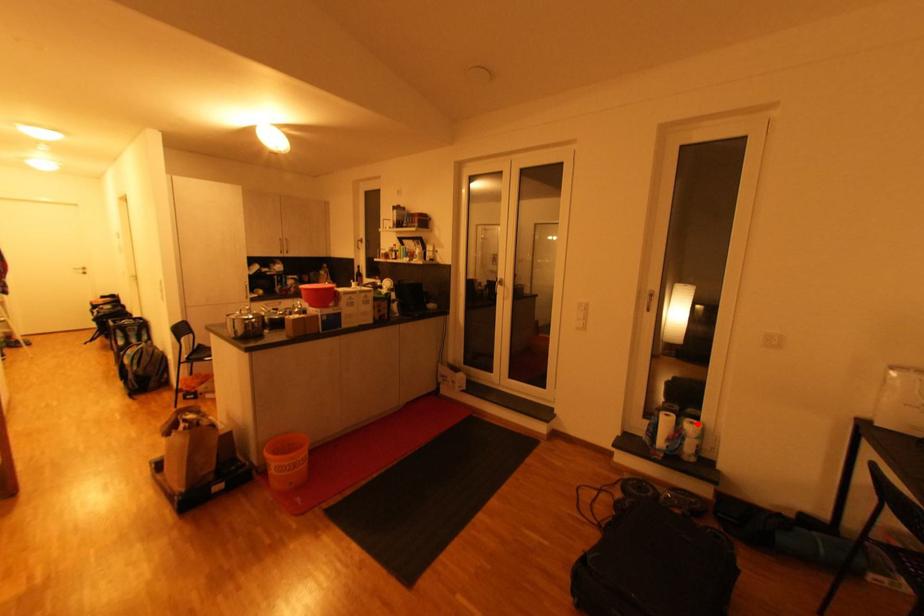
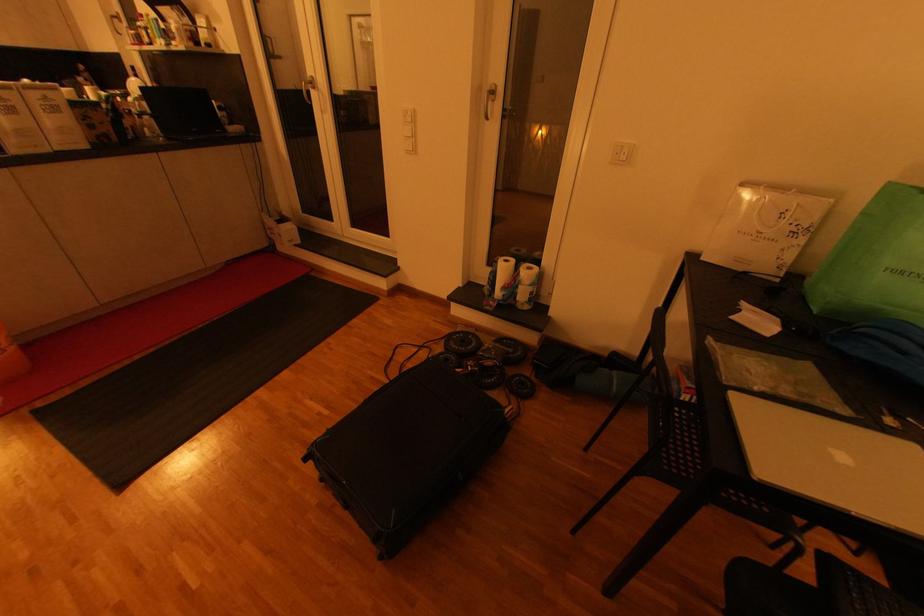
In the second image, find the point that corresponds to the highlighted location in the first image.

(533, 269)